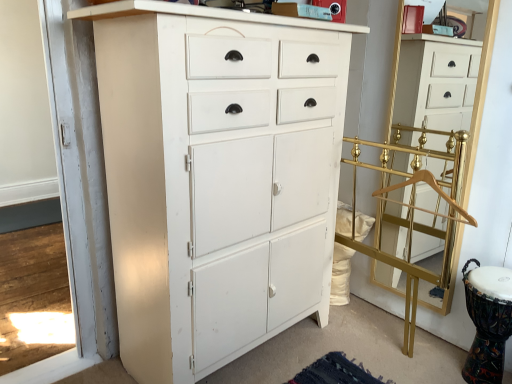
Question: Does white painted wood cabinet at center, marked as the second chest of drawers in a right-to-left arrangement, appear on the right side of gold wooden hanger at right?

Choices:
 (A) yes
 (B) no

Answer: (B)

Question: From the image's perspective, does white painted wood cabinet at center, marked as the second chest of drawers in a right-to-left arrangement, appear higher than gold wooden hanger at right?

Choices:
 (A) no
 (B) yes

Answer: (A)

Question: From a real-world perspective, is white painted wood cabinet at center, acting as the first chest of drawers starting from the left, on top of gold wooden hanger at right?

Choices:
 (A) yes
 (B) no

Answer: (B)

Question: Considering the relative sizes of white painted wood cabinet at center, acting as the first chest of drawers starting from the left, and gold wooden hanger at right in the image provided, is white painted wood cabinet at center, acting as the first chest of drawers starting from the left, smaller than gold wooden hanger at right?

Choices:
 (A) yes
 (B) no

Answer: (B)

Question: Is white painted wood cabinet at center, acting as the first chest of drawers starting from the left, aimed at gold wooden hanger at right?

Choices:
 (A) yes
 (B) no

Answer: (A)

Question: Does white painted wood cabinet at center, marked as the second chest of drawers in a right-to-left arrangement, touch gold wooden hanger at right?

Choices:
 (A) yes
 (B) no

Answer: (B)

Question: Considering the relative positions of gold wooden hanger at right and white painted wood cabinet at center, acting as the first chest of drawers starting from the left, in the image provided, is gold wooden hanger at right to the left of white painted wood cabinet at center, acting as the first chest of drawers starting from the left, from the viewer's perspective?

Choices:
 (A) no
 (B) yes

Answer: (A)

Question: Is gold wooden hanger at right smaller than white painted wood cabinet at center, acting as the first chest of drawers starting from the left?

Choices:
 (A) no
 (B) yes

Answer: (B)

Question: Is white painted wood cabinet at center, marked as the second chest of drawers in a right-to-left arrangement, at the back of gold wooden hanger at right?

Choices:
 (A) no
 (B) yes

Answer: (A)

Question: Is gold wooden hanger at right outside of white painted wood cabinet at center, acting as the first chest of drawers starting from the left?

Choices:
 (A) yes
 (B) no

Answer: (A)

Question: Considering the relative sizes of gold wooden hanger at right and white painted wood cabinet at center, marked as the second chest of drawers in a right-to-left arrangement, in the image provided, is gold wooden hanger at right thinner than white painted wood cabinet at center, marked as the second chest of drawers in a right-to-left arrangement,?

Choices:
 (A) no
 (B) yes

Answer: (B)

Question: From a real-world perspective, is gold wooden hanger at right positioned over white painted wood cabinet at center, acting as the first chest of drawers starting from the left, based on gravity?

Choices:
 (A) yes
 (B) no

Answer: (A)

Question: Is gold metallic coat rack at right smaller than gold metallic coat rack at right, which is counted as the 2th chest of drawers, starting from the left?

Choices:
 (A) yes
 (B) no

Answer: (B)